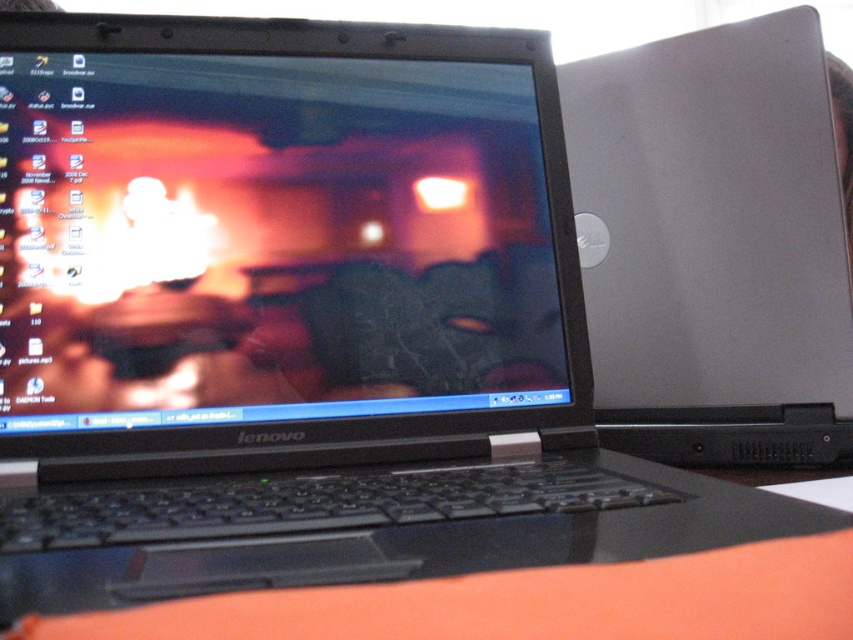
Can you confirm if matte black laptop at center is shorter than silver metallic laptop at right?

Yes, matte black laptop at center is shorter than silver metallic laptop at right.

Is matte black laptop at center below silver metallic laptop at right?

No, matte black laptop at center is not below silver metallic laptop at right.

What do you see at coordinates (270, 241) in the screenshot? The width and height of the screenshot is (853, 640). I see `matte black laptop at center` at bounding box center [270, 241].

Find the location of a particular element. matte black laptop at center is located at coordinates (270, 241).

Is silver metallic laptop at right positioned behind orange fabric at lower center?

Yes, it is.

Between silver metallic laptop at right and orange fabric at lower center, which one is positioned higher?

silver metallic laptop at right is above.

Locate an element on the screen. This screenshot has width=853, height=640. silver metallic laptop at right is located at coordinates (717, 243).

Between matte black laptop at center and orange fabric at lower center, which one has more height?

With more height is matte black laptop at center.

Does matte black laptop at center appear under orange fabric at lower center?

No, matte black laptop at center is not below orange fabric at lower center.

Find the location of `matte black laptop at center`. matte black laptop at center is located at coordinates (270, 241).